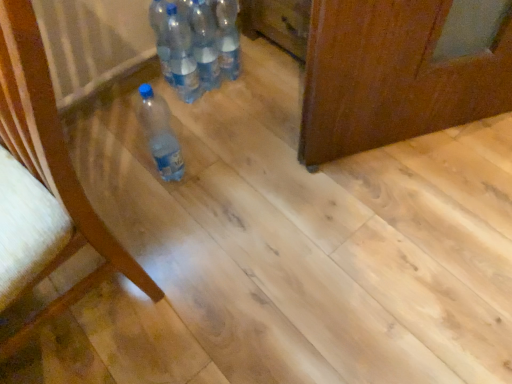
Where is `free space in front of translucent plastic bottle at lower left, marked as the 1th bottle in a bottom-to-top arrangement`? The height and width of the screenshot is (384, 512). free space in front of translucent plastic bottle at lower left, marked as the 1th bottle in a bottom-to-top arrangement is located at coordinates (169, 216).